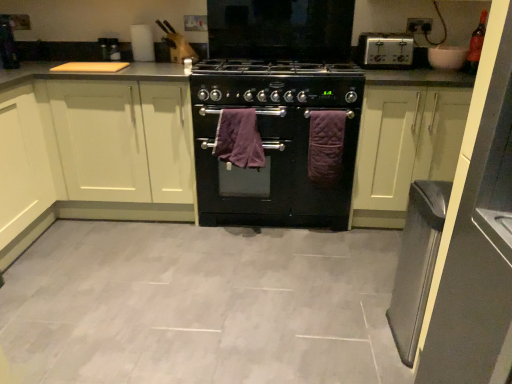
Question: Considering the relative positions of black matte oven at center and silver metallic toaster at upper right in the image provided, is black matte oven at center to the right of silver metallic toaster at upper right from the viewer's perspective?

Choices:
 (A) yes
 (B) no

Answer: (B)

Question: Does black matte oven at center have a lesser width compared to silver metallic toaster at upper right?

Choices:
 (A) no
 (B) yes

Answer: (A)

Question: From a real-world perspective, is black matte oven at center positioned over silver metallic toaster at upper right based on gravity?

Choices:
 (A) no
 (B) yes

Answer: (A)

Question: Does black matte oven at center have a larger size compared to silver metallic toaster at upper right?

Choices:
 (A) no
 (B) yes

Answer: (B)

Question: Is black matte oven at center smaller than silver metallic toaster at upper right?

Choices:
 (A) no
 (B) yes

Answer: (A)

Question: Looking at their shapes, would you say black matte gas stove at center is wider or thinner than white matte cabinet at left, marked as the 1th cabinetry in a left-to-right arrangement?

Choices:
 (A) thin
 (B) wide

Answer: (A)

Question: From the image's perspective, is black matte gas stove at center positioned above or below white matte cabinet at left, marked as the 1th cabinetry in a left-to-right arrangement?

Choices:
 (A) below
 (B) above

Answer: (B)

Question: Considering their positions, is black matte gas stove at center located in front of or behind white matte cabinet at left, marked as the 1th cabinetry in a left-to-right arrangement?

Choices:
 (A) behind
 (B) front

Answer: (B)

Question: Is point (324, 97) positioned closer to the camera than point (56, 193)?

Choices:
 (A) farther
 (B) closer

Answer: (B)

Question: From the image's perspective, is black matte gas stove at center above or below white matte cabinet at center, the 2th cabinetry in the left-to-right sequence?

Choices:
 (A) below
 (B) above

Answer: (B)

Question: From a real-world perspective, is black matte gas stove at center above or below white matte cabinet at center, which appears as the first cabinetry when viewed from the right?

Choices:
 (A) above
 (B) below

Answer: (A)

Question: Do you think black matte gas stove at center is within white matte cabinet at center, which appears as the first cabinetry when viewed from the right, or outside of it?

Choices:
 (A) outside
 (B) inside

Answer: (A)

Question: In terms of width, does black matte gas stove at center look wider or thinner when compared to white matte cabinet at center, which appears as the first cabinetry when viewed from the right?

Choices:
 (A) wide
 (B) thin

Answer: (B)

Question: In terms of height, does black matte gas stove at center look taller or shorter compared to purple quilted towel at center, the first bath towel when ordered from right to left?

Choices:
 (A) short
 (B) tall

Answer: (A)

Question: Considering the positions of black matte gas stove at center and purple quilted towel at center, the 2th bath towel from the left, in the image, is black matte gas stove at center bigger or smaller than purple quilted towel at center, the 2th bath towel from the left,?

Choices:
 (A) small
 (B) big

Answer: (B)